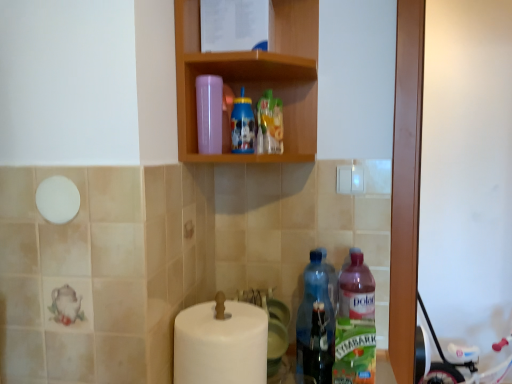
Question: From the image's perspective, is polar translucent bottle at lower right, which is counted as the 1th bottle, starting from the right, above or below blue plastic bottle at upper center, marked as the 2th bottle in a left-to-right arrangement?

Choices:
 (A) above
 (B) below

Answer: (B)

Question: From their relative heights in the image, would you say polar translucent bottle at lower right, which is counted as the 1th bottle, starting from the right, is taller or shorter than blue plastic bottle at upper center, which appears as the 3th bottle when viewed from the right?

Choices:
 (A) tall
 (B) short

Answer: (A)

Question: Estimate the real-world distances between objects in this image. Which object is closer to the white plastic baby carriage at lower right?

Choices:
 (A) blue plastic bottle at upper center, which appears as the 3th bottle when viewed from the right
 (B) wooden shelf at upper center
 (C) white matte toilet paper at lower center
 (D) transparent plastic bottle at lower center, the third bottle when ordered from left to right
 (E) transparent plastic bottle at upper center, the 4th bottle positioned from the right

Answer: (D)

Question: Based on their relative distances, which object is nearer to the polar translucent bottle at lower right, which is counted as the 1th bottle, starting from the right?

Choices:
 (A) transparent plastic bottle at lower center, the third bottle when ordered from left to right
 (B) white plastic baby carriage at lower right
 (C) blue plastic bottle at upper center, which appears as the 3th bottle when viewed from the right
 (D) white matte toilet paper at lower center
 (E) transparent plastic bottle at upper center, which ranks as the 1th bottle in left-to-right order

Answer: (A)